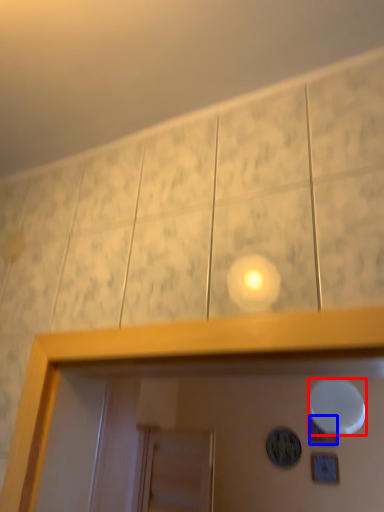
Question: Which object is further to the camera taking this photo, mirror (highlighted by a red box) or dot (highlighted by a blue box)?

Choices:
 (A) mirror
 (B) dot

Answer: (B)